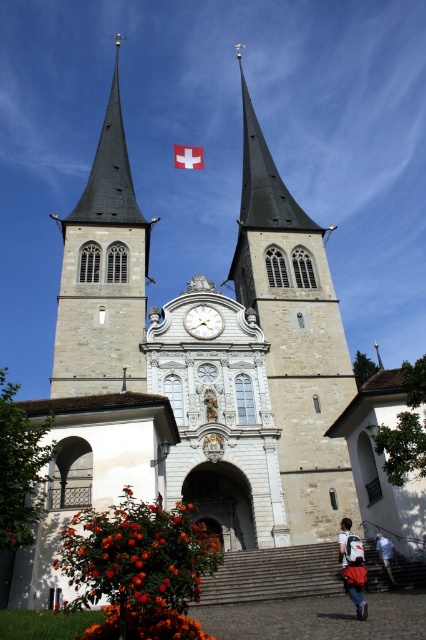
How far apart are gray stone bell tower at left and white glossy clock at center?

gray stone bell tower at left and white glossy clock at center are 62.72 meters apart.

Does gray stone bell tower at left have a larger size compared to white glossy clock at center?

Correct, gray stone bell tower at left is larger in size than white glossy clock at center.

Where is `gray stone bell tower at left`? Image resolution: width=426 pixels, height=640 pixels. gray stone bell tower at left is located at coordinates (103, 273).

Which is above, white glossy clock at center or white fabric flag at center?

white fabric flag at center is above.

Who is more distant from viewer, (x=187, y=316) or (x=190, y=147)?

Point (x=190, y=147)

This screenshot has width=426, height=640. I want to click on white glossy clock at center, so click(x=203, y=321).

Does light brown stone stairs at center appear under denim jacket at lower right?

Correct, light brown stone stairs at center is located below denim jacket at lower right.

Can you confirm if light brown stone stairs at center is positioned above denim jacket at lower right?

Incorrect, light brown stone stairs at center is not positioned above denim jacket at lower right.

In order to click on light brown stone stairs at center in this screenshot , I will do tap(273, 573).